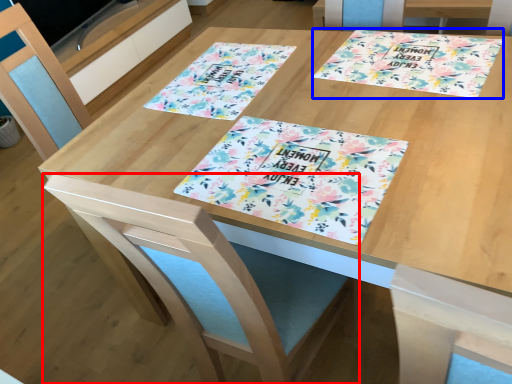
Question: Which point is closer to the camera, swivel chair (highlighted by a red box) or tablecloth (highlighted by a blue box)?

Choices:
 (A) swivel chair
 (B) tablecloth

Answer: (A)